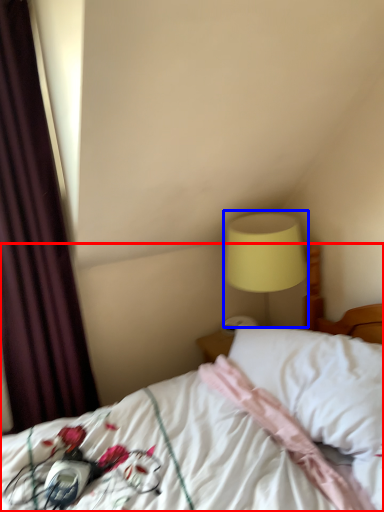
Question: Which object is closer to the camera taking this photo, bed (highlighted by a red box) or bedside lamp (highlighted by a blue box)?

Choices:
 (A) bed
 (B) bedside lamp

Answer: (A)